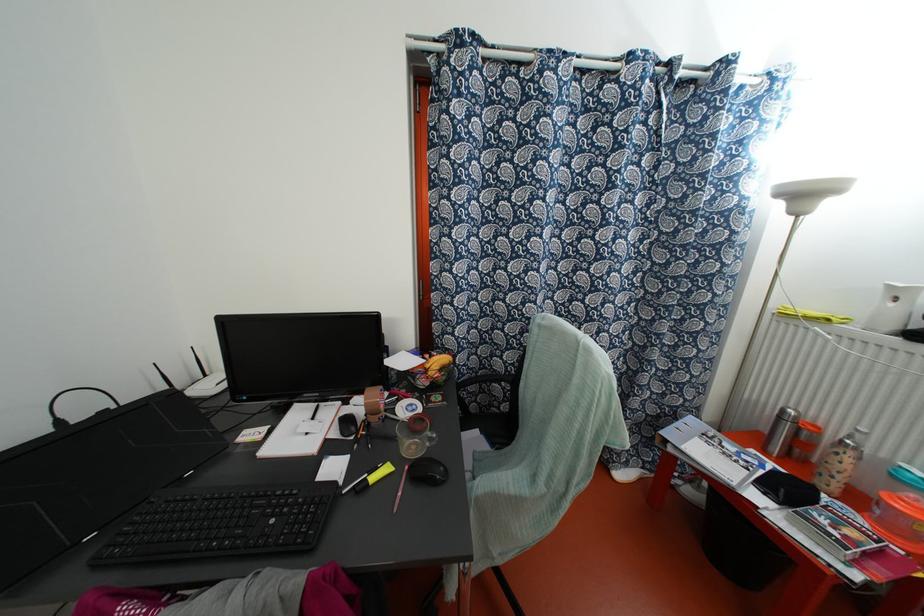
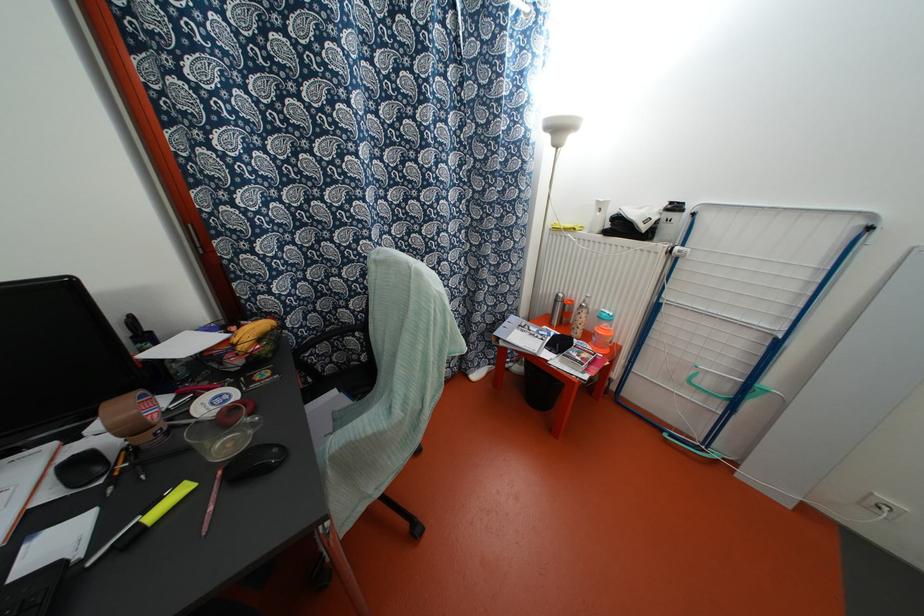
Where in the second image is the point corresponding to (850,453) from the first image?

(584, 310)